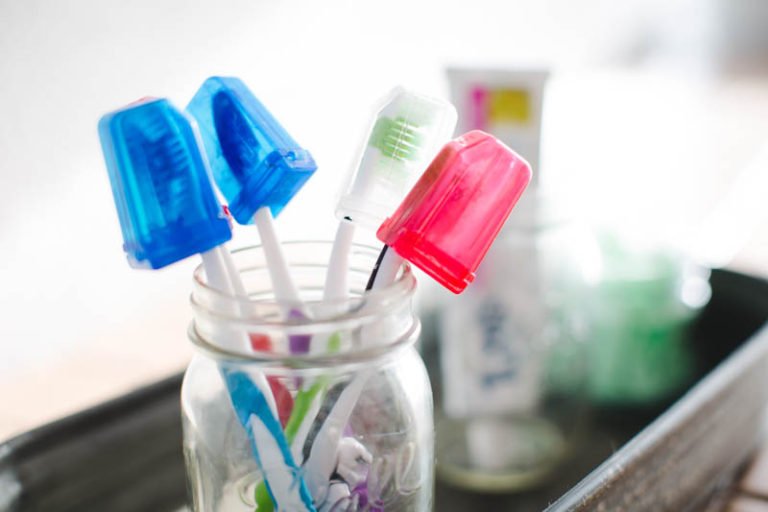
Locate an element on the screen. The width and height of the screenshot is (768, 512). green toothbrush is located at coordinates (296, 407).